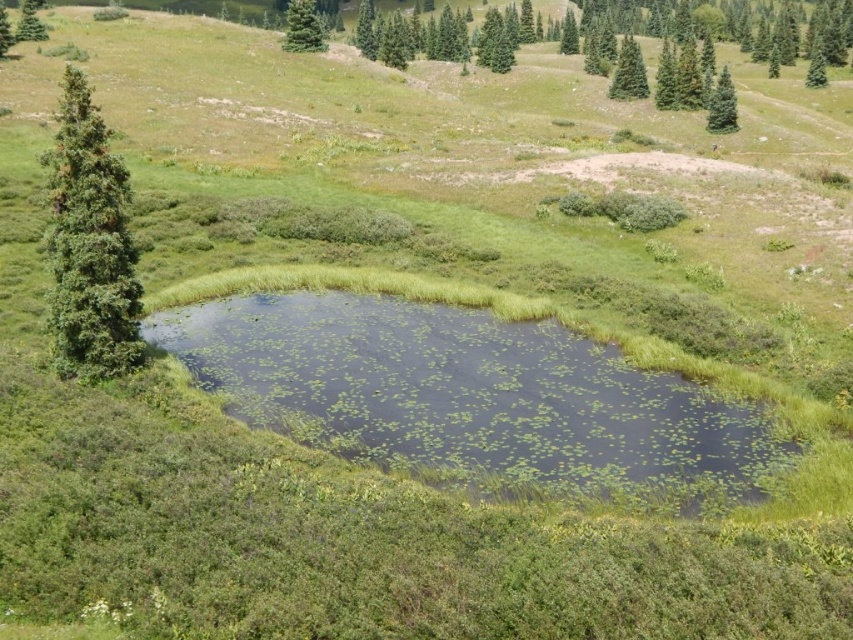
Is green textured tree at left positioned before green textured pine tree at upper right?

Yes, green textured tree at left is closer to the viewer.

How distant is green textured tree at left from green textured pine tree at upper right?

They are 146.41 meters apart.

Is point (61, 257) positioned after point (814, 77)?

No, (61, 257) is in front of (814, 77).

Locate an element on the screen. Image resolution: width=853 pixels, height=640 pixels. green textured tree at left is located at coordinates (90, 244).

Does green textured pine tree at upper right have a larger size compared to green matte tree at upper center?

Actually, green textured pine tree at upper right might be smaller than green matte tree at upper center.

Who is shorter, green textured pine tree at upper right or green matte tree at upper center?

green textured pine tree at upper right

Does point (817, 60) come closer to viewer compared to point (561, 22)?

That is True.

Find the location of a particular element. The height and width of the screenshot is (640, 853). green textured pine tree at upper right is located at coordinates (816, 67).

Looking at this image, is green grassy lake at center thinner than green matte evergreen tree at upper center?

In fact, green grassy lake at center might be wider than green matte evergreen tree at upper center.

Which is more to the right, green grassy lake at center or green matte evergreen tree at upper center?

green grassy lake at center is more to the right.

In order to click on green grassy lake at center in this screenshot , I will do `click(473, 400)`.